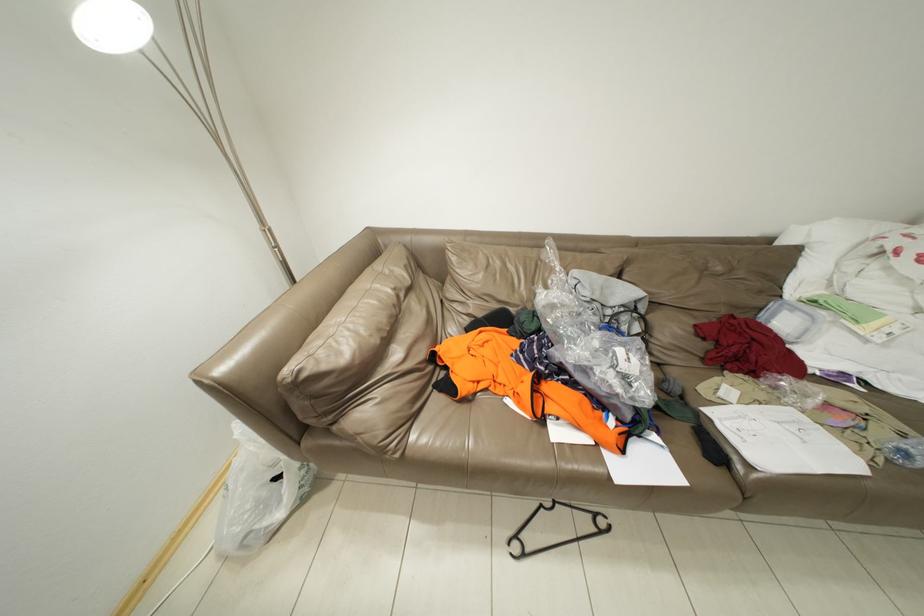
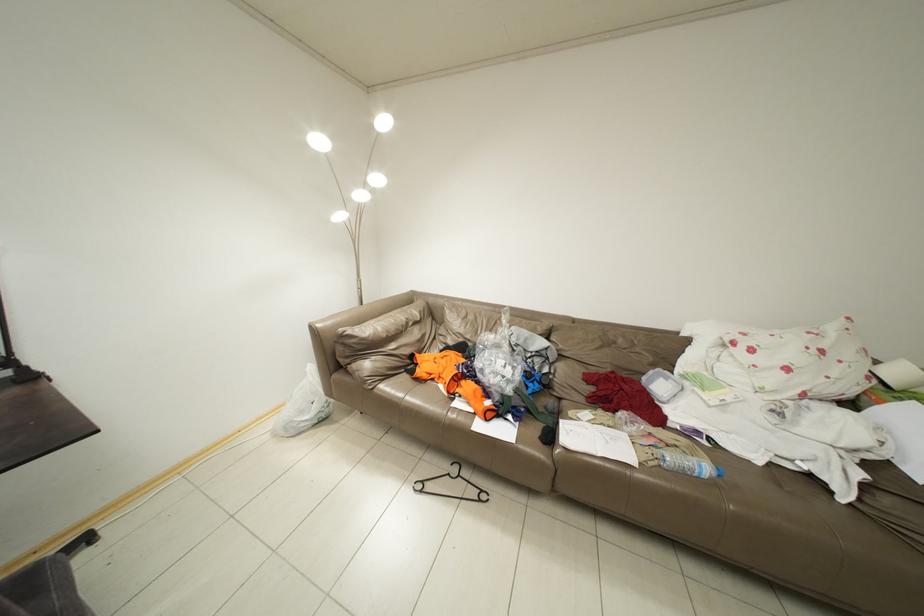
Consider the image. How did the camera likely rotate?

The camera rotated toward left-up.